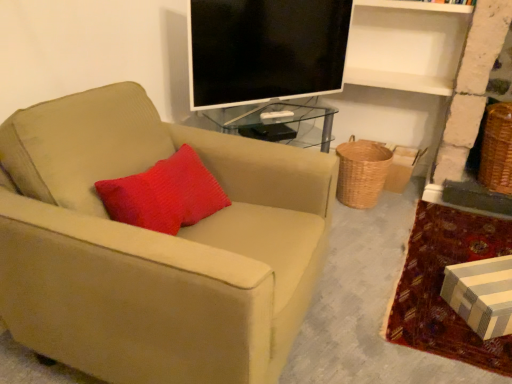
This screenshot has height=384, width=512. In order to click on vacant position to the left of striped cardboard box at lower right in this screenshot , I will do `click(426, 308)`.